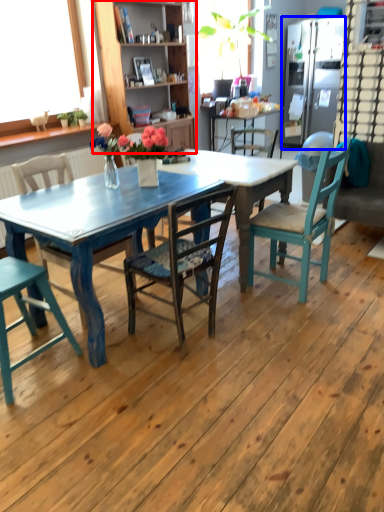
Question: Which object appears farthest to the camera in this image, cabinetry (highlighted by a red box) or refrigerator (highlighted by a blue box)?

Choices:
 (A) cabinetry
 (B) refrigerator

Answer: (B)